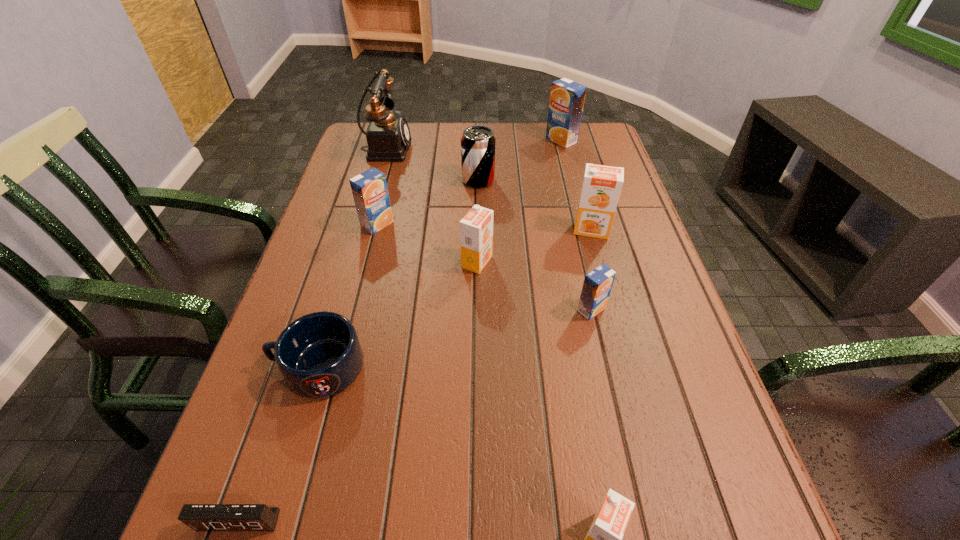
Identify the location of vacant space situated on the front of the leftmost blue orange_juice. (367, 266).

I want to click on vacant region located on the left of the sixth farthest object, so click(389, 262).

In order to click on vacant space located 0.070m on the right of the nearest blue orange_juice in this screenshot , I will do `click(639, 309)`.

Where is `telephone that is at the far edge`? This screenshot has height=540, width=960. telephone that is at the far edge is located at coordinates (388, 136).

Where is `orange_juice present at the far edge`? orange_juice present at the far edge is located at coordinates (567, 97).

Image resolution: width=960 pixels, height=540 pixels. I want to click on telephone situated at the left edge, so click(388, 136).

You are a GUI agent. You are given a task and a screenshot of the screen. Output one action in this format:
    pyautogui.click(x=<x>, y=<y>)
    Task: Click on the orange_juice at the left edge
    
    Given the screenshot: What is the action you would take?
    pyautogui.click(x=370, y=192)

Image resolution: width=960 pixels, height=540 pixels. I want to click on mug situated at the left edge, so click(319, 355).

Image resolution: width=960 pixels, height=540 pixels. I want to click on alarm clock that is at the left edge, so click(x=200, y=517).

Find the location of a particular element. The width and height of the screenshot is (960, 540). object that is at the far left corner is located at coordinates (388, 136).